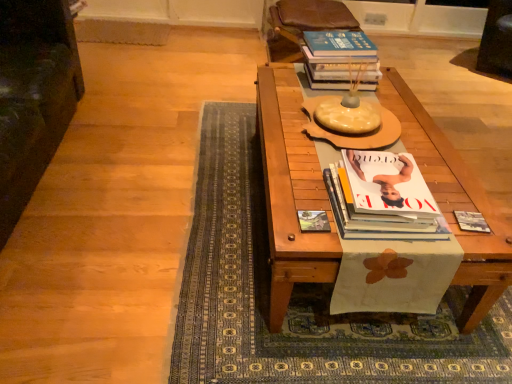
Where is `vacant space that is to the left of white glossy magazine at center, the third book from the back`? vacant space that is to the left of white glossy magazine at center, the third book from the back is located at coordinates (301, 201).